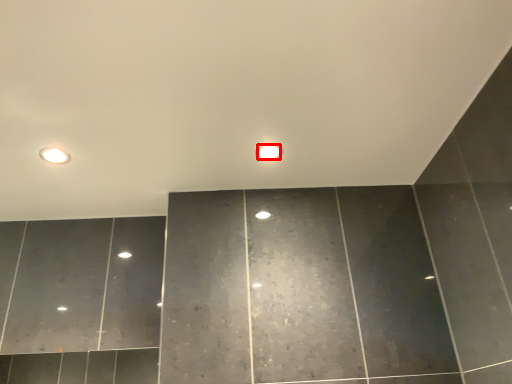
Question: From the image, what is the correct spatial relationship of light bulb (annotated by the red box) in relation to fixture?

Choices:
 (A) right
 (B) left

Answer: (A)